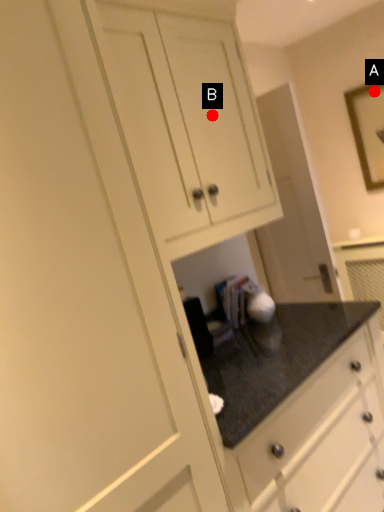
Question: Two points are circled on the image, labeled by A and B beside each circle. Which point is closer to the camera?

Choices:
 (A) A is closer
 (B) B is closer

Answer: (B)